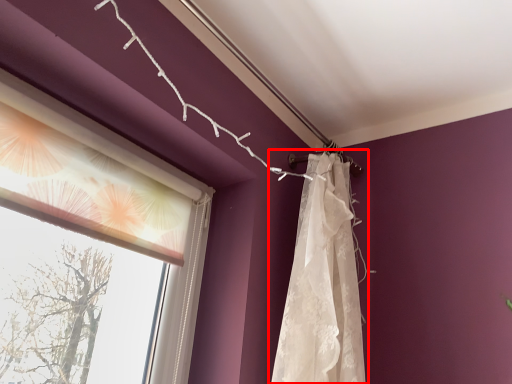
Question: Considering the relative positions of curtain (annotated by the red box) and window in the image provided, where is curtain (annotated by the red box) located with respect to the staircase?

Choices:
 (A) left
 (B) right

Answer: (B)